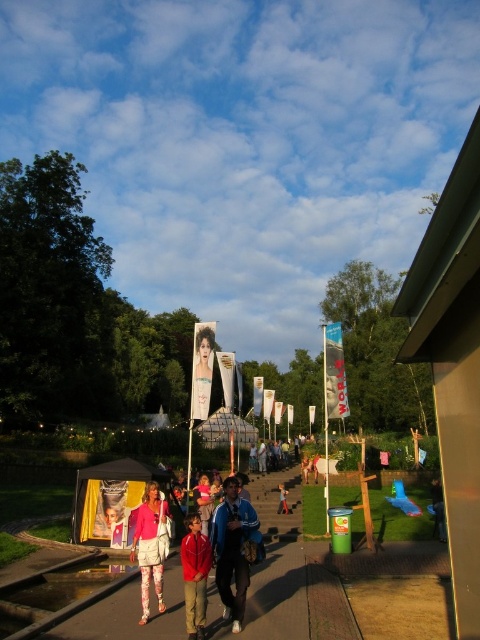
You are standing at the point marked by the coordinates point (233, 548). Looking around, you see a blue fabric jacket at center. What is the closest object to you?

The closest object to you is the blue fabric jacket at center, as you are standing at the coordinates indicating its location.

You are standing at the camera position and want to place a small flag at the closest point between point (235,566) and point (283,496). Which point should you choose?

Point (235,566) is closer to the camera than point (283,496), so you should place the flag at point (235,566).